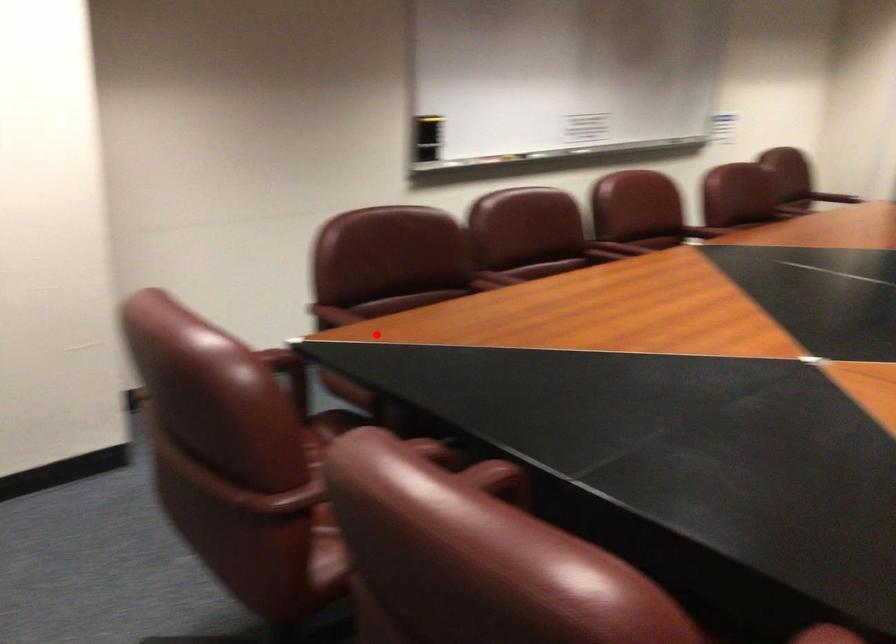
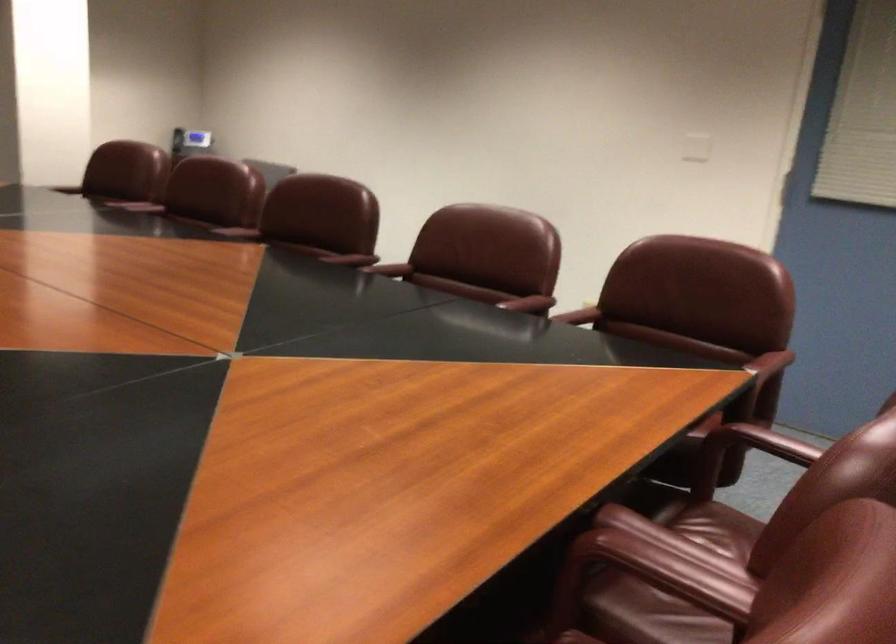
Question: I am providing you with two images of the same scene from different viewpoints. A red point is marked on the first image. Can you still see the location of the red point in image 2?

Choices:
 (A) Yes
 (B) No

Answer: (A)